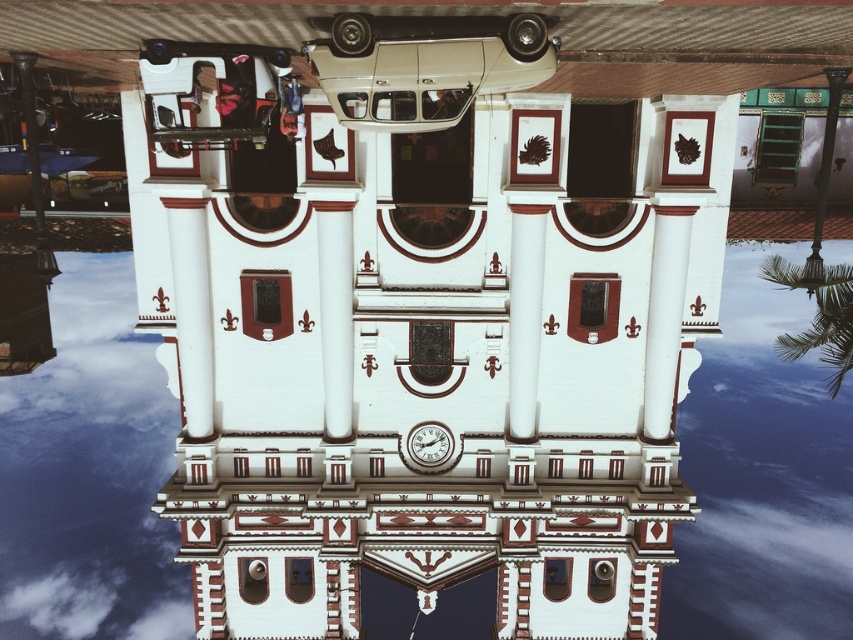
You are an architect analyzing the symmetry of the building and its reflection. Given that the white glossy column at center and the metallic gold clock at center are both central elements, which one appears taller in the image?

The white glossy column at center is taller than the metallic gold clock at center, so it appears taller in the image.

You are an architect analyzing the symmetry of the building and its reflection in the water. Given that the transparent glass water at center and metallic gold clock at center are part of this symmetrical design, which object occupies a greater area in the composition?

The transparent glass water at center has a larger size compared to the metallic gold clock at center, so it occupies a greater area in the composition.